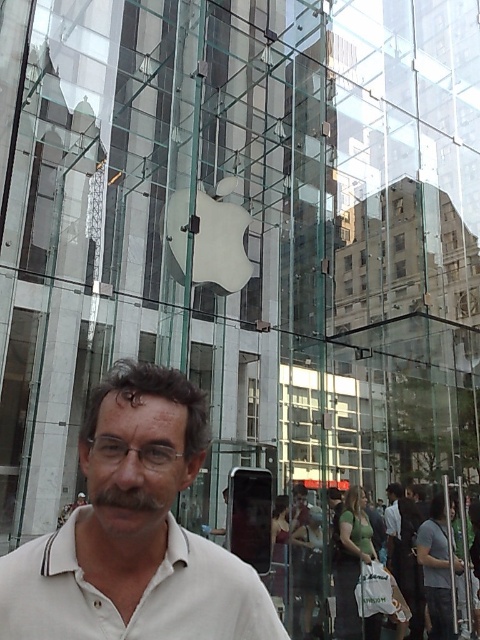
Which is more to the left, gray cotton t-shirt at center or dark gray shirt at center?

Positioned to the left is dark gray shirt at center.

Which is behind, point (422, 566) or point (392, 528)?

Point (392, 528)

Where is `gray cotton t-shirt at center`? This screenshot has height=640, width=480. gray cotton t-shirt at center is located at coordinates (437, 568).

Looking at this image, does white matte shirt at center appear on the left side of gray cotton t-shirt at center?

Indeed, white matte shirt at center is positioned on the left side of gray cotton t-shirt at center.

Is white matte shirt at center taller than gray cotton t-shirt at center?

No.

The width and height of the screenshot is (480, 640). Find the location of `white matte shirt at center`. white matte shirt at center is located at coordinates (134, 532).

Can you confirm if white cotton polo shirt at center is positioned to the left of dark gray shirt at center?

Yes, white cotton polo shirt at center is to the left of dark gray shirt at center.

Who is shorter, white cotton polo shirt at center or dark gray shirt at center?

white cotton polo shirt at center is shorter.

Between point (37, 577) and point (419, 518), which one is positioned in front?

Point (37, 577) is more forward.

The height and width of the screenshot is (640, 480). Find the location of `white cotton polo shirt at center`. white cotton polo shirt at center is located at coordinates click(x=141, y=596).